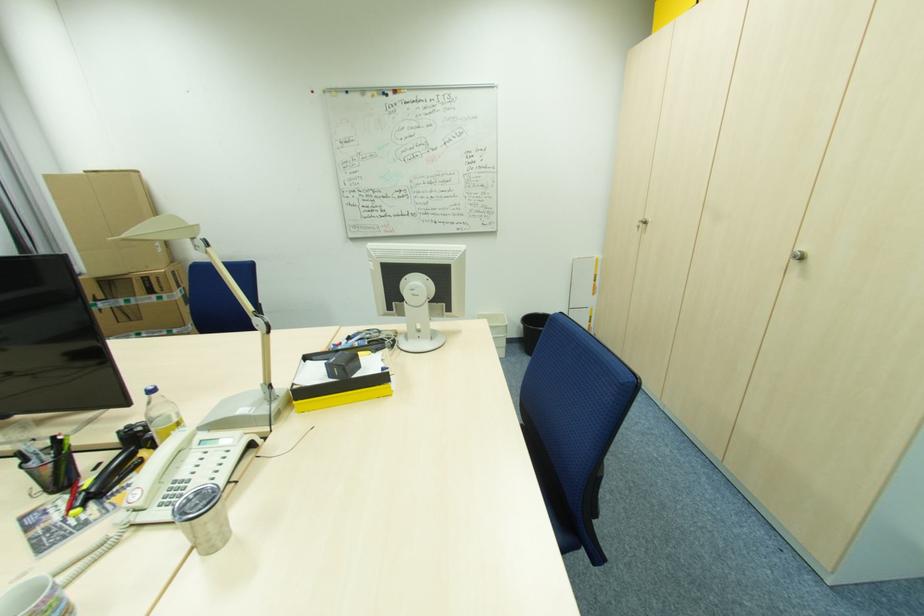
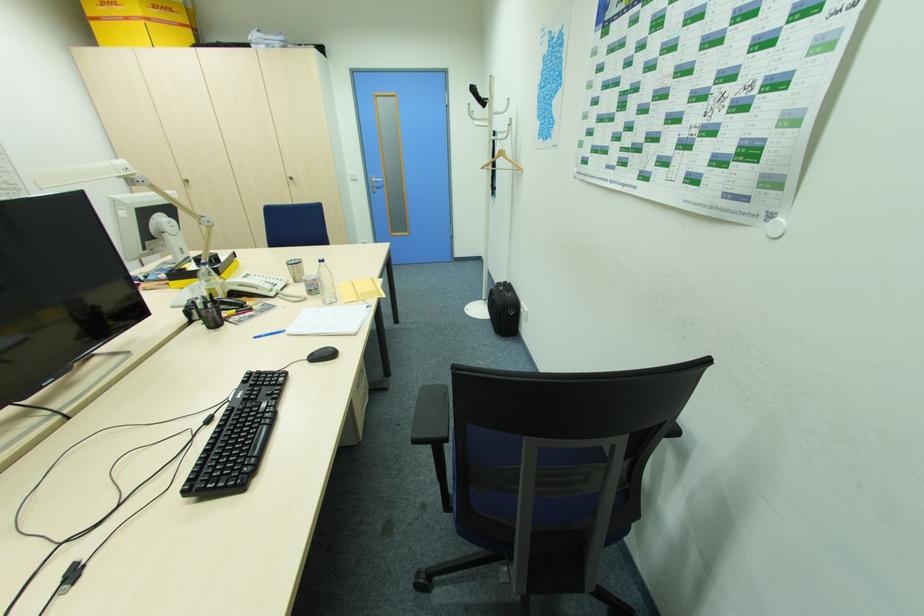
In the second image, find the point that corresponds to [641,227] in the first image.

(188, 185)